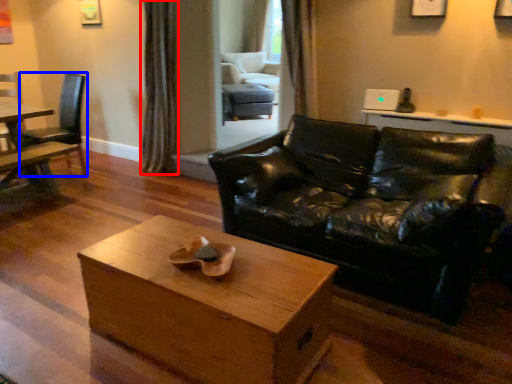
Question: Which of the following is the closest to the observer, curtain (highlighted by a red box) or chair (highlighted by a blue box)?

Choices:
 (A) curtain
 (B) chair

Answer: (B)